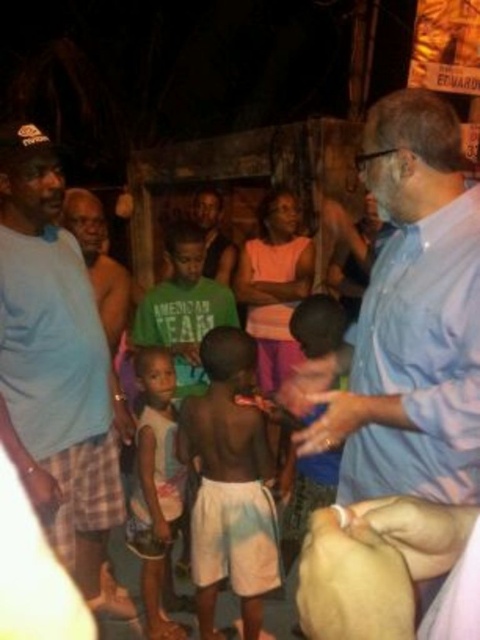
Question: Is white cotton shirt at center thinner than green t-shirt at center?

Choices:
 (A) no
 (B) yes

Answer: (B)

Question: Estimate the real-world distances between objects in this image. Which object is farther from the light blue t-shirt at left?

Choices:
 (A) light blue shirt at upper right
 (B) green t-shirt at center

Answer: (B)

Question: Which object is the farthest from the white cotton shirt at center?

Choices:
 (A) green t-shirt at center
 (B) light blue shirt at upper right
 (C) light skin smooth skin at center

Answer: (A)

Question: Does light blue shirt at upper right appear over light blue t-shirt at left?

Choices:
 (A) no
 (B) yes

Answer: (B)

Question: Which point is closer to the camera?

Choices:
 (A) light blue t-shirt at left
 (B) light skin smooth skin at center

Answer: (A)

Question: Can you confirm if light blue shirt at upper right is positioned to the left of light skin smooth skin at center?

Choices:
 (A) no
 (B) yes

Answer: (A)